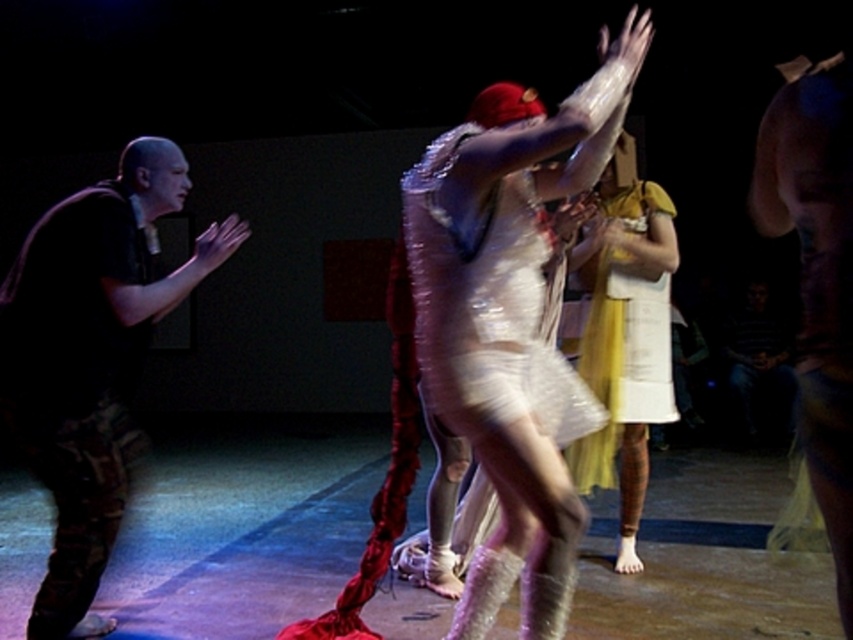
Which is more to the left, camouflage pants at left or camouflage pants at right?

From the viewer's perspective, camouflage pants at left appears more on the left side.

Between point (61, 554) and point (844, 474), which one is positioned in front?

Positioned in front is point (844, 474).

Who is more distant from viewer, (x=65, y=204) or (x=836, y=259)?

Point (x=65, y=204)

I want to click on camouflage pants at left, so click(x=91, y=358).

Can you confirm if shiny silver dress at center is thinner than camouflage pants at left?

Correct, shiny silver dress at center's width is less than camouflage pants at left's.

Can you confirm if shiny silver dress at center is positioned above camouflage pants at left?

Yes.

Find the location of a particular element. shiny silver dress at center is located at coordinates (511, 326).

Is point (538, 307) positioned behind point (614, 353)?

That is False.

From the picture: Can you confirm if shiny white dress at center is bigger than yellow satin dress at center?

Actually, shiny white dress at center might be smaller than yellow satin dress at center.

I want to click on shiny white dress at center, so click(486, 307).